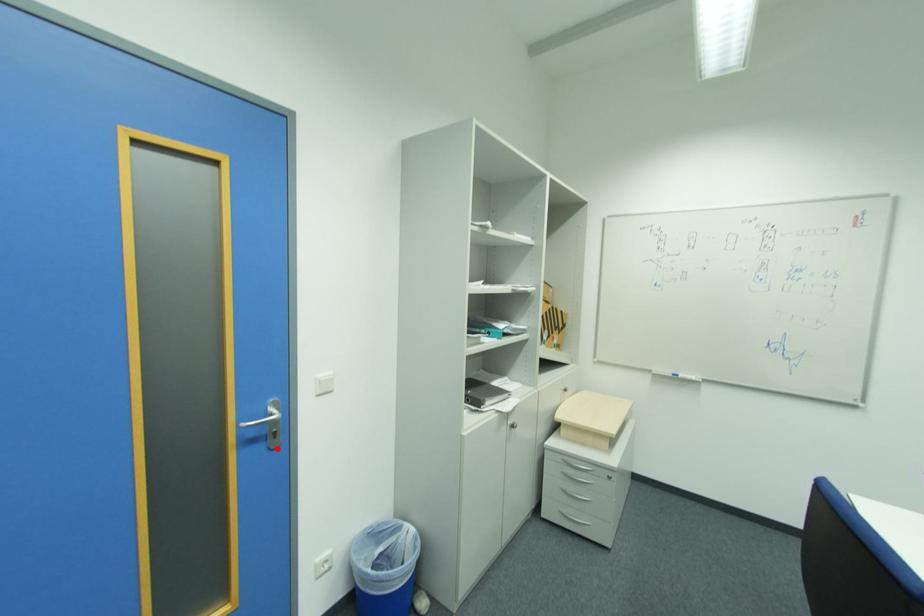
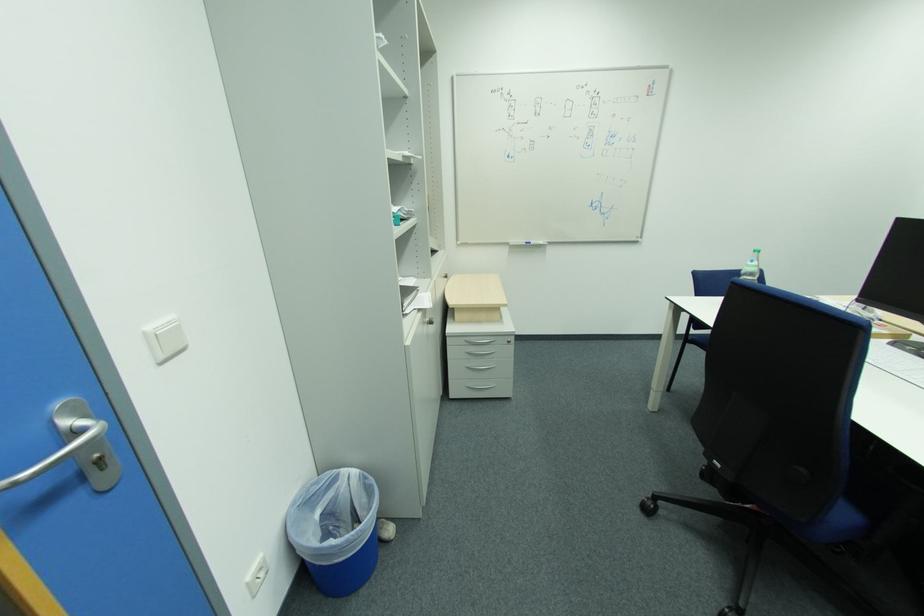
Locate, in the second image, the point that corresponds to the highlighted location in the first image.

(111, 488)